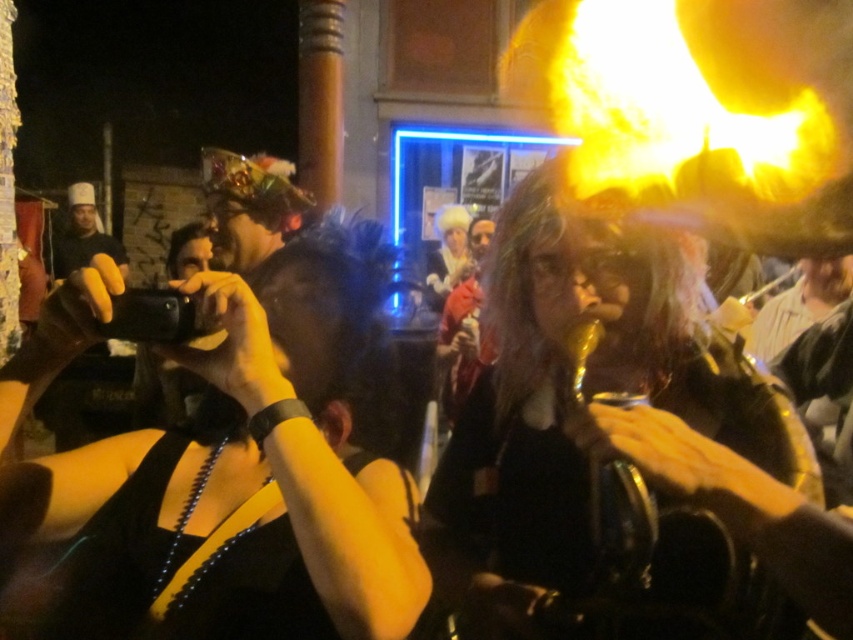
Question: Which point is closer to the camera taking this photo?

Choices:
 (A) coord(219,376)
 (B) coord(566,278)

Answer: (A)

Question: Among these objects, which one is nearest to the camera?

Choices:
 (A) black matte camera at center
 (B) shiny black hair at center

Answer: (A)

Question: Observing the image, what is the correct spatial positioning of black matte camera at center in reference to shiny black hair at center?

Choices:
 (A) below
 (B) above

Answer: (A)

Question: Which of the following is the closest to the observer?

Choices:
 (A) shiny black hair at center
 (B) black matte camera at center

Answer: (B)

Question: Does black matte camera at center lie behind shiny black hair at center?

Choices:
 (A) yes
 (B) no

Answer: (B)

Question: Is black matte camera at center smaller than shiny black hair at center?

Choices:
 (A) yes
 (B) no

Answer: (A)